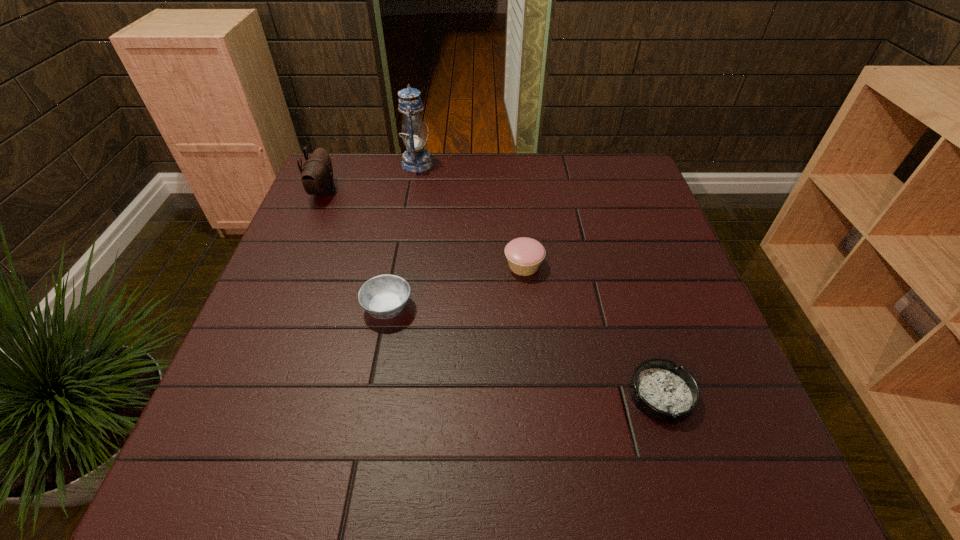
The width and height of the screenshot is (960, 540). In order to click on the tallest object in this screenshot , I will do `click(416, 159)`.

You are a GUI agent. You are given a task and a screenshot of the screen. Output one action in this format:
    pyautogui.click(x=<x>, y=<y>)
    Task: Click on the farthest object
    
    Given the screenshot: What is the action you would take?
    pyautogui.click(x=416, y=159)

Where is `the leftmost object`? The width and height of the screenshot is (960, 540). the leftmost object is located at coordinates (317, 174).

Find the location of a particular element. the second farthest object is located at coordinates (317, 174).

Identify the location of the second object from right to left. This screenshot has width=960, height=540. (524, 255).

Find the location of a particular element. The width and height of the screenshot is (960, 540). the third nearest object is located at coordinates (524, 255).

You are a GUI agent. You are given a task and a screenshot of the screen. Output one action in this format:
    pyautogui.click(x=<x>, y=<y>)
    Task: Click on the taller ashtray
    The width and height of the screenshot is (960, 540).
    Given the screenshot: What is the action you would take?
    pyautogui.click(x=385, y=296)

I want to click on the farther ashtray, so click(385, 296).

Locate an element on the screen. This screenshot has width=960, height=540. the rightmost object is located at coordinates (663, 391).

At what (x,y) coordinates should I click in order to perform the action: click on the shortest object. Please return your answer as a coordinate pair (x, y). The image size is (960, 540). Looking at the image, I should click on (663, 391).